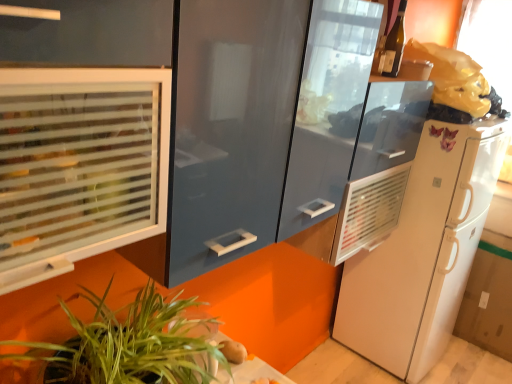
Question: Can you confirm if translucent glass wine bottle at upper right is positioned to the left of smooth brown potato at lower center?

Choices:
 (A) no
 (B) yes

Answer: (A)

Question: Is translucent glass wine bottle at upper right in front of smooth brown potato at lower center?

Choices:
 (A) no
 (B) yes

Answer: (A)

Question: From the image's perspective, is translucent glass wine bottle at upper right located beneath smooth brown potato at lower center?

Choices:
 (A) no
 (B) yes

Answer: (A)

Question: Is translucent glass wine bottle at upper right outside smooth brown potato at lower center?

Choices:
 (A) no
 (B) yes

Answer: (B)

Question: Does translucent glass wine bottle at upper right have a greater width compared to smooth brown potato at lower center?

Choices:
 (A) no
 (B) yes

Answer: (A)

Question: Is white matte refrigerator at right in front of or behind frosted glass window at left in the image?

Choices:
 (A) front
 (B) behind

Answer: (B)

Question: In terms of size, does white matte refrigerator at right appear bigger or smaller than frosted glass window at left?

Choices:
 (A) big
 (B) small

Answer: (A)

Question: Considering the positions of white matte refrigerator at right and frosted glass window at left in the image, is white matte refrigerator at right taller or shorter than frosted glass window at left?

Choices:
 (A) short
 (B) tall

Answer: (B)

Question: From a real-world perspective, is white matte refrigerator at right physically located above or below frosted glass window at left?

Choices:
 (A) below
 (B) above

Answer: (A)

Question: Is point click(87, 205) closer or farther from the camera than point click(390, 48)?

Choices:
 (A) closer
 (B) farther

Answer: (A)

Question: Looking at their shapes, would you say frosted glass window at left is wider or thinner than translucent glass wine bottle at upper right?

Choices:
 (A) thin
 (B) wide

Answer: (B)

Question: Would you say frosted glass window at left is to the left or to the right of translucent glass wine bottle at upper right in the picture?

Choices:
 (A) left
 (B) right

Answer: (A)

Question: Is frosted glass window at left in front of or behind translucent glass wine bottle at upper right in the image?

Choices:
 (A) behind
 (B) front

Answer: (B)

Question: Is smooth brown potato at lower center inside the boundaries of translucent glass wine bottle at upper right, or outside?

Choices:
 (A) inside
 (B) outside

Answer: (B)

Question: From their relative heights in the image, would you say smooth brown potato at lower center is taller or shorter than translucent glass wine bottle at upper right?

Choices:
 (A) short
 (B) tall

Answer: (A)